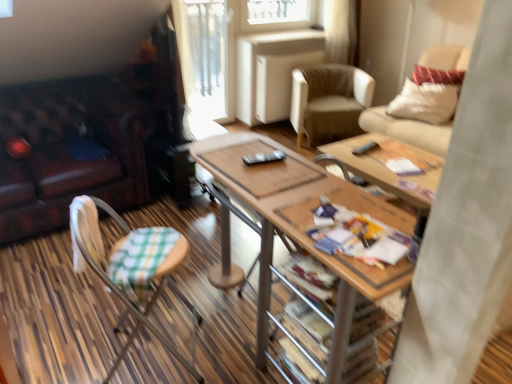
I want to click on vacant space in front of printed paper magazine at center, so click(x=375, y=274).